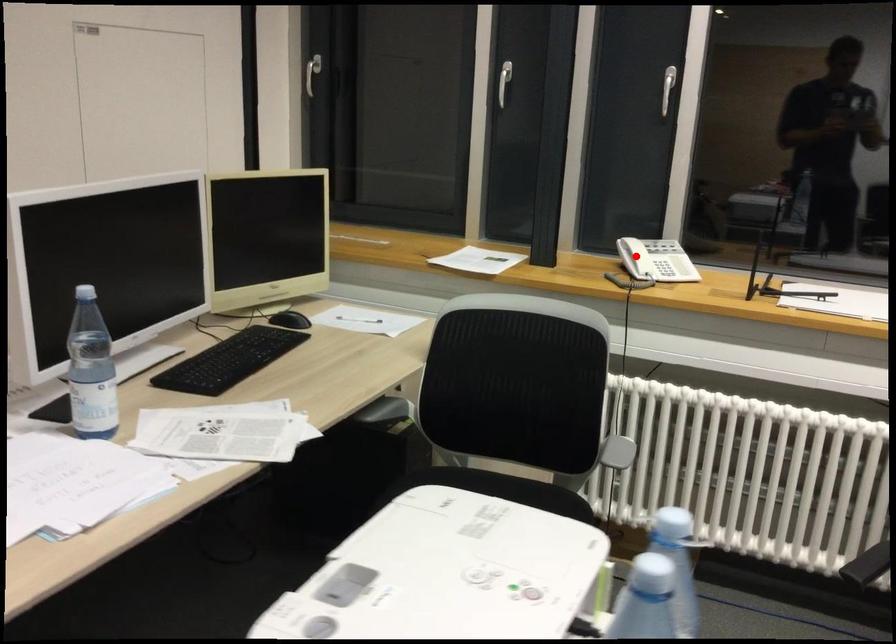
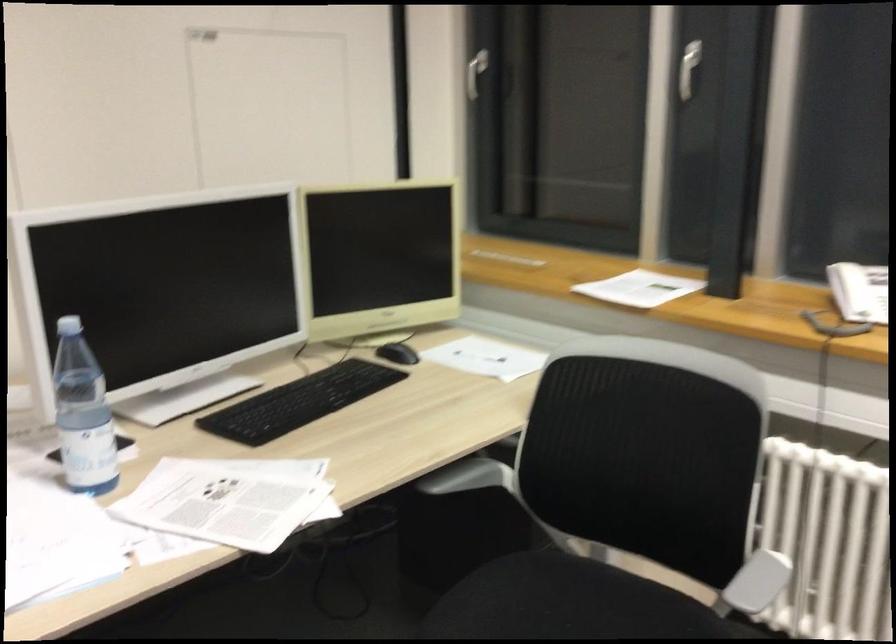
Question: I am providing you with two images of the same scene from different viewpoints. Image1 has a red point marked. In image2, the corresponding 3D location appears at what relative position? Reply with the corresponding letter.

Choices:
 (A) Closer
 (B) Farther

Answer: (A)